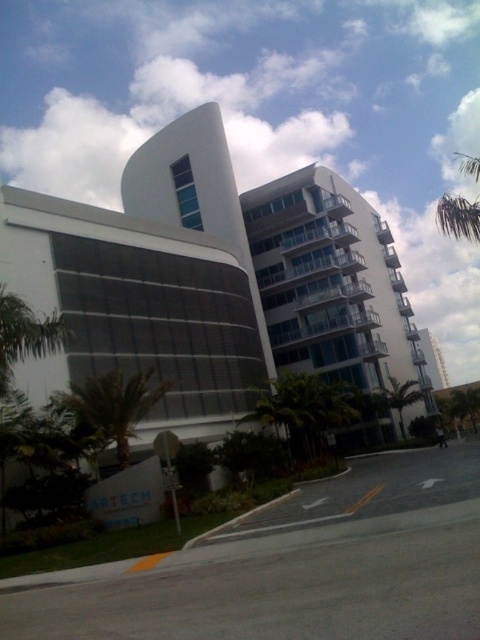
Does point (339, 291) lie in front of point (387, 406)?

No, (339, 291) is behind (387, 406).

Between glassy white balconies at center and green leafy palm tree at center-right, which one is positioned higher?

glassy white balconies at center is above.

Image resolution: width=480 pixels, height=640 pixels. Describe the element at coordinates (335, 291) in the screenshot. I see `glassy white balconies at center` at that location.

Where is `glassy white balconies at center`? Image resolution: width=480 pixels, height=640 pixels. glassy white balconies at center is located at coordinates (335, 291).

Which is below, glassy white balconies at center or green leafy palm tree at lower left?

green leafy palm tree at lower left is below.

Can you confirm if glassy white balconies at center is shorter than green leafy palm tree at lower left?

No, glassy white balconies at center is not shorter than green leafy palm tree at lower left.

Find the location of `glassy white balconies at center`. glassy white balconies at center is located at coordinates (335, 291).

Between green leafy palm tree at lower left and green leafy palm tree at center-right, which one is positioned higher?

green leafy palm tree at lower left

Does green leafy palm tree at lower left have a greater height compared to green leafy palm tree at center-right?

In fact, green leafy palm tree at lower left may be shorter than green leafy palm tree at center-right.

Find the location of a particular element. The width and height of the screenshot is (480, 640). green leafy palm tree at lower left is located at coordinates tap(111, 406).

This screenshot has width=480, height=640. I want to click on green leafy palm tree at lower left, so click(x=111, y=406).